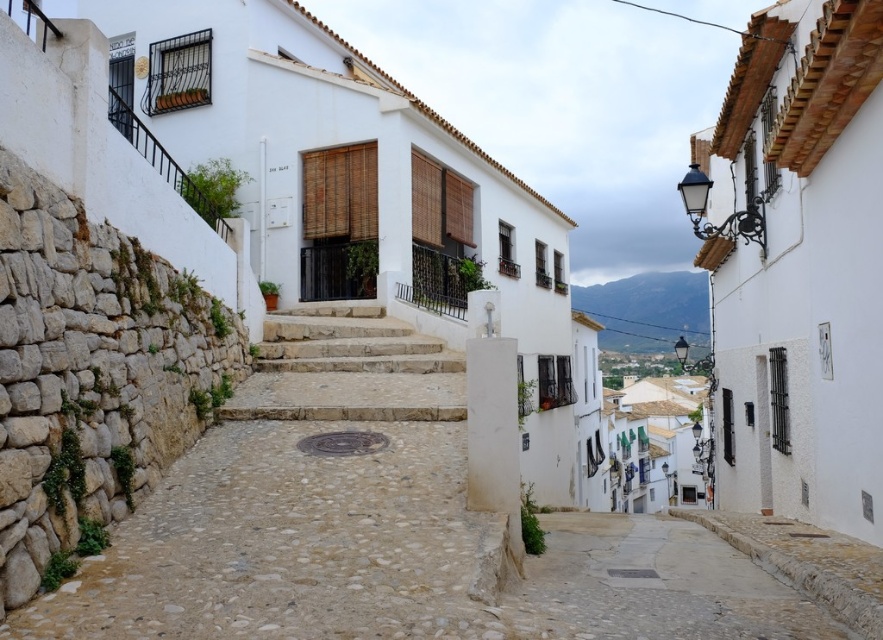
You are a tourist in a Mediterranean town and want to walk from the natural stone path at center to the natural stone stairs at center. Which direction should you turn to reach the stairs from the path?

You should turn to your right to reach the natural stone stairs at center from the natural stone path at center, as the path is to the left of the stairs.

You are a tourist visiting the town and want to walk from the smooth stone path at lower center to the natural stone stairs at center. Which path is higher in elevation?

The smooth stone path at lower center is higher in elevation than the natural stone stairs at center.